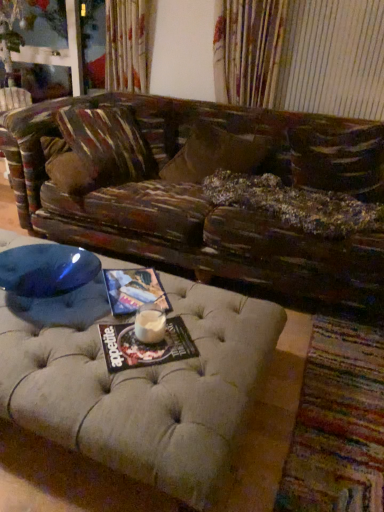
The image size is (384, 512). What are the coordinates of `free point in front of white frothy liquid at center` in the screenshot? It's located at [147, 354].